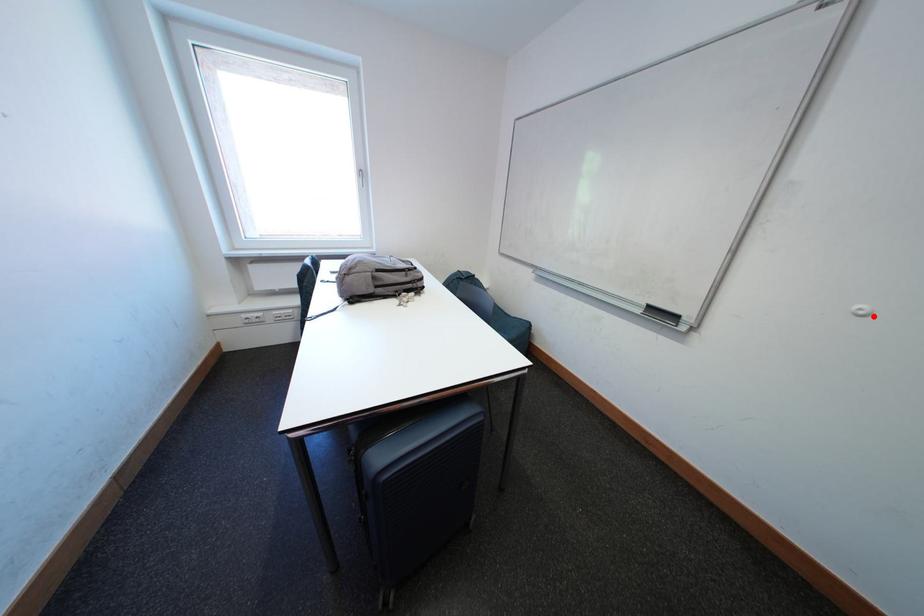
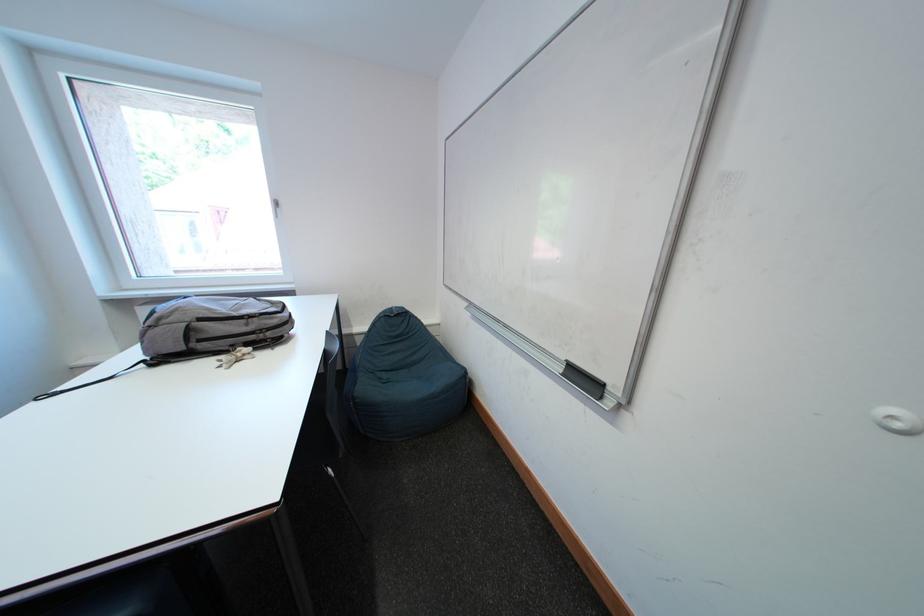
Question: I am providing you with two images of the same scene from different viewpoints. In image1, a red point is highlighted. Considering the same 3D point in image2, which of the following is correct?

Choices:
 (A) It is closer
 (B) It is farther

Answer: (B)